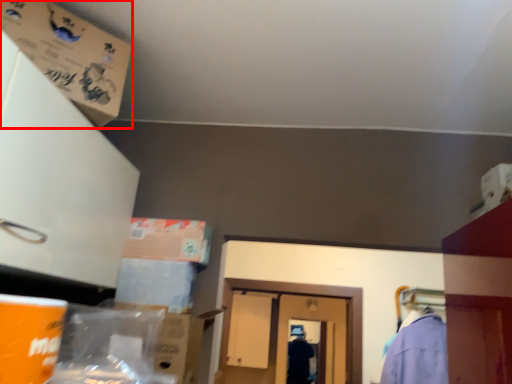
Question: From the image's perspective, what is the correct spatial positioning of cardboard box (annotated by the red box) in reference to cardboard box?

Choices:
 (A) above
 (B) below

Answer: (A)